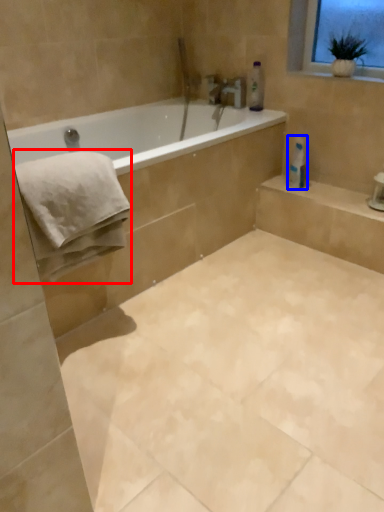
Question: Which object is closer to the camera taking this photo, bath towel (highlighted by a red box) or toilet paper (highlighted by a blue box)?

Choices:
 (A) bath towel
 (B) toilet paper

Answer: (A)